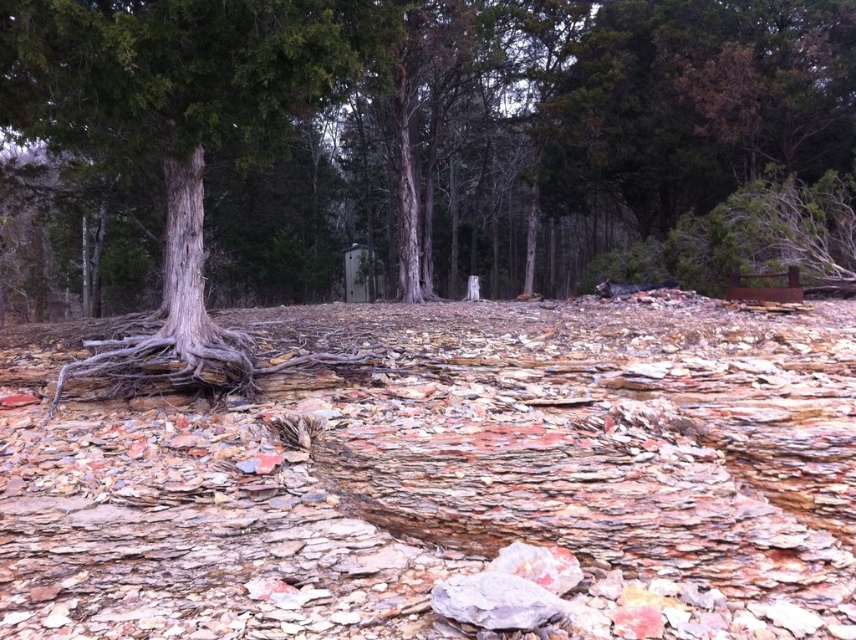
Question: Can you confirm if rusty stone rock at center is bigger than gray textured tree trunk at left?

Choices:
 (A) yes
 (B) no

Answer: (A)

Question: Can you confirm if rusty stone rock at center is positioned below gray textured tree trunk at left?

Choices:
 (A) yes
 (B) no

Answer: (A)

Question: Is rusty stone rock at center wider than gray textured tree trunk at left?

Choices:
 (A) no
 (B) yes

Answer: (B)